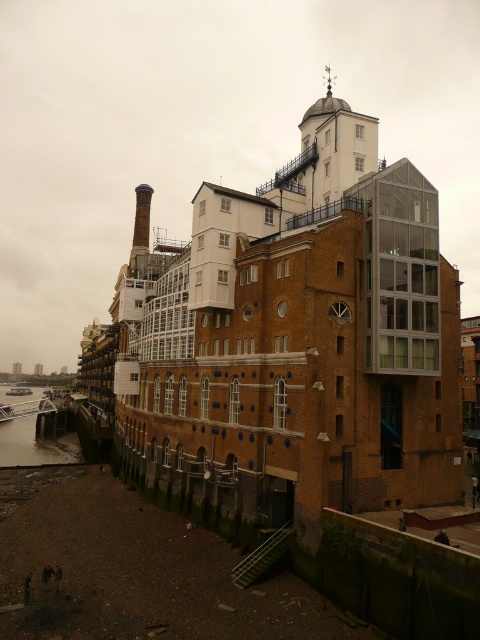
Between point (228, 352) and point (74, 458), which one is positioned in front?

Point (228, 352) is in front.

Find the location of a particular element. The height and width of the screenshot is (640, 480). brown brick building at center is located at coordinates (297, 339).

You are a GUI agent. You are given a task and a screenshot of the screen. Output one action in this format:
    pyautogui.click(x=<x>, y=<y>)
    Task: Click on the brown brick building at center
    This screenshot has height=640, width=480.
    Given the screenshot: What is the action you would take?
    pyautogui.click(x=297, y=339)

Is brown brick building at center closer to camera compared to red brick chimney at center-left?

Yes, brown brick building at center is in front of red brick chimney at center-left.

Describe the element at coordinates (297, 339) in the screenshot. I see `brown brick building at center` at that location.

I want to click on brown brick building at center, so click(297, 339).

Is greenish water at lower left shorter than red brick chimney at center-left?

Indeed, greenish water at lower left has a lesser height compared to red brick chimney at center-left.

Who is taller, greenish water at lower left or red brick chimney at center-left?

Standing taller between the two is red brick chimney at center-left.

Measure the distance between greenish water at lower left and camera.

A distance of 399.61 feet exists between greenish water at lower left and camera.

Find the location of `greenish water at lower left`. greenish water at lower left is located at coordinates (35, 444).